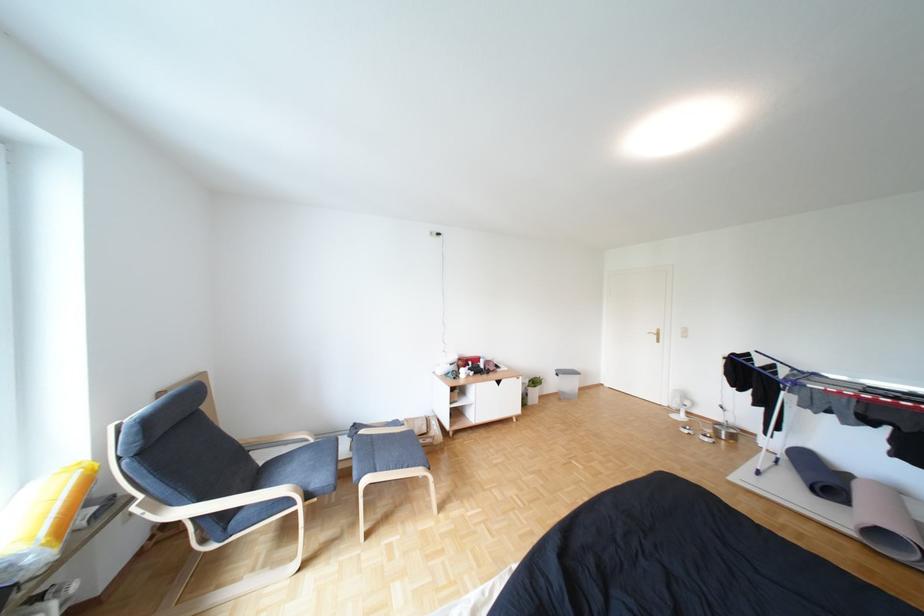
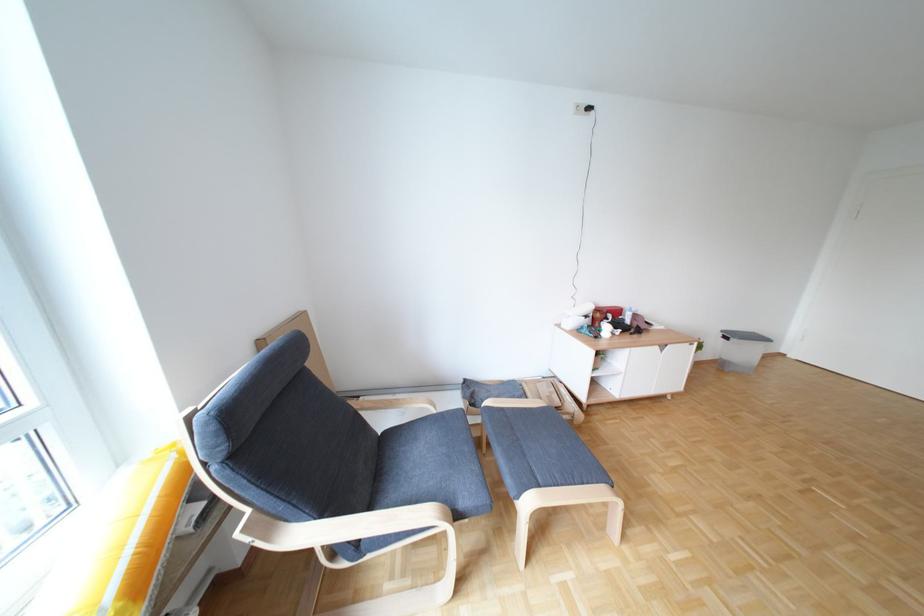
Locate, in the second image, the point that corresponds to point 217,408 in the first image.

(322, 363)